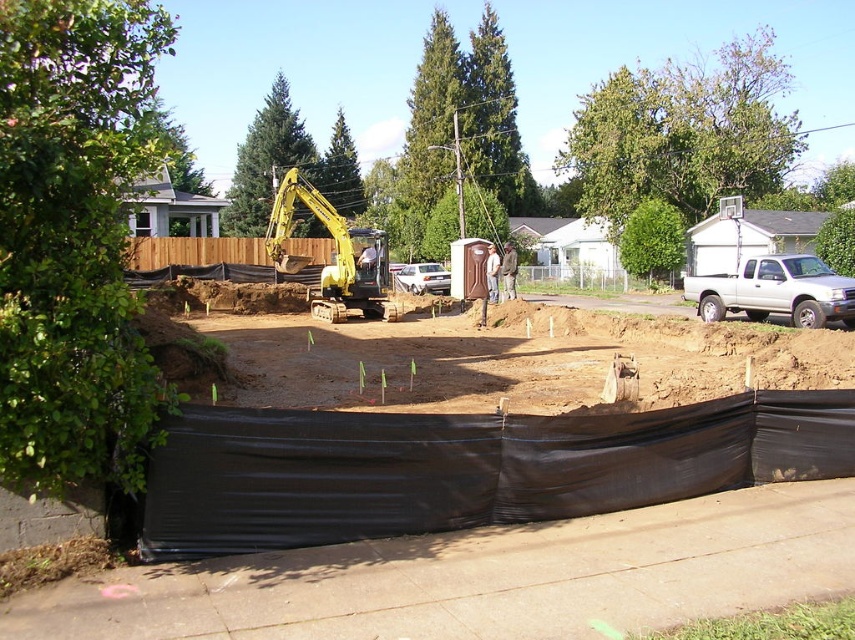
Question: Can you confirm if black plastic tarp at center is bigger than yellow rubber excavator at center?

Choices:
 (A) yes
 (B) no

Answer: (B)

Question: Which point appears closest to the camera in this image?

Choices:
 (A) (587, 388)
 (B) (320, 209)

Answer: (A)

Question: Can you confirm if black plastic tarp at center is smaller than yellow rubber excavator at center?

Choices:
 (A) yes
 (B) no

Answer: (A)

Question: Does black plastic tarp at center have a smaller size compared to yellow rubber excavator at center?

Choices:
 (A) no
 (B) yes

Answer: (B)

Question: Among these points, which one is farthest from the camera?

Choices:
 (A) pyautogui.click(x=240, y=547)
 (B) pyautogui.click(x=351, y=234)

Answer: (B)

Question: Which of the following is the closest to the observer?

Choices:
 (A) (682, 346)
 (B) (388, 316)

Answer: (A)